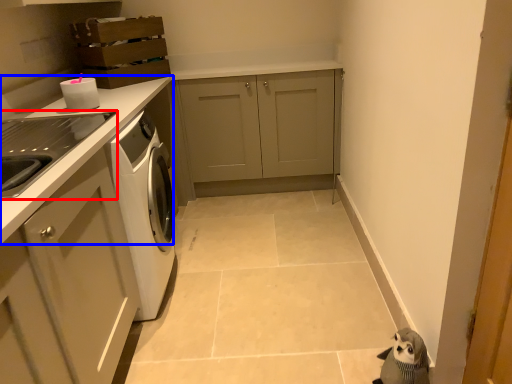
Question: Which of the following is the farthest to the observer, home appliance (highlighted by a red box) or countertop (highlighted by a blue box)?

Choices:
 (A) home appliance
 (B) countertop

Answer: (B)